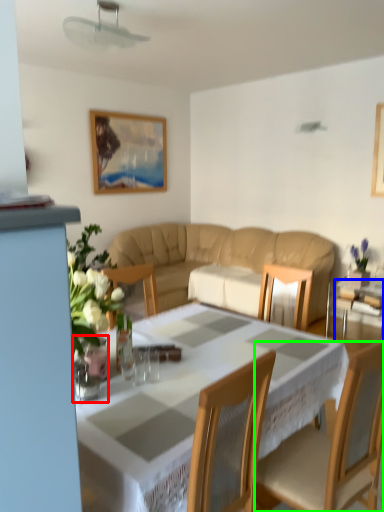
Question: Based on their relative distances, which object is nearer to glass vase (highlighted by a red box)? Choose from glass table (highlighted by a blue box) and chair (highlighted by a green box).

Choices:
 (A) glass table
 (B) chair

Answer: (B)